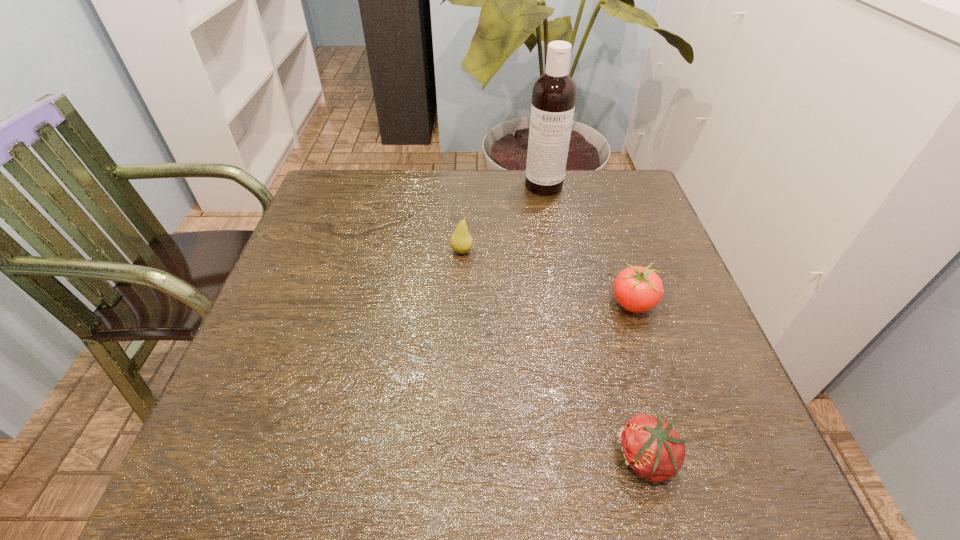
Find the location of a particular element. This screenshot has width=960, height=540. vacant space that satisfies the following two spatial constraints: 1. on the label side of the third tallest object; 2. on the left side of the tallest object is located at coordinates (565, 303).

Where is `vacant area in the image that satisfies the following two spatial constraints: 1. on the back side of the taller tomato; 2. on the left side of the nearer tomato`? This screenshot has height=540, width=960. vacant area in the image that satisfies the following two spatial constraints: 1. on the back side of the taller tomato; 2. on the left side of the nearer tomato is located at coordinates (605, 303).

You are a GUI agent. You are given a task and a screenshot of the screen. Output one action in this format:
    pyautogui.click(x=<x>, y=<y>)
    Task: Click on the vacant position in the image that satisfies the following two spatial constraints: 1. on the label side of the second shortest object; 2. on the right side of the farthest object
    This screenshot has height=540, width=960.
    Given the screenshot: What is the action you would take?
    pyautogui.click(x=565, y=303)